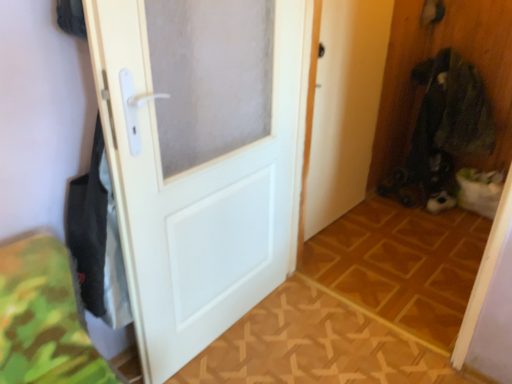
Question: Does point (264, 134) appear closer or farther from the camera than point (223, 352)?

Choices:
 (A) farther
 (B) closer

Answer: (B)

Question: Considering the relative positions of white matte door at center and wooden parquet floor at center, which is counted as the first tile, starting from the front, in the image provided, is white matte door at center to the left or to the right of wooden parquet floor at center, which is counted as the first tile, starting from the front,?

Choices:
 (A) right
 (B) left

Answer: (B)

Question: Which object is positioned farthest from the white matte door at center?

Choices:
 (A) dark green fabric at right
 (B) wooden floor at center, which ranks as the second tile in front-to-back order
 (C) wooden parquet floor at center, which is counted as the first tile, starting from the front

Answer: (A)

Question: Which is farther from the dark green fabric at right?

Choices:
 (A) wooden floor at center, which appears as the first tile when viewed from the back
 (B) wooden parquet floor at center, the 2th tile in the back-to-front sequence
 (C) white matte door at center

Answer: (C)